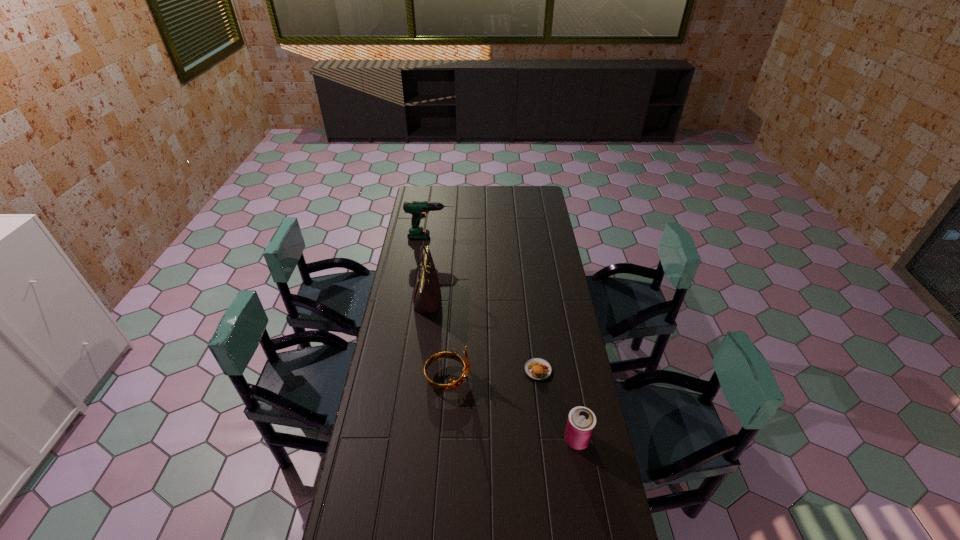
At what (x,y) coordinates should I click in order to perform the action: click on object that is the fourth closest one to the handbag. Please return your answer as a coordinate pair (x, y). Looking at the image, I should click on (581, 422).

This screenshot has width=960, height=540. In order to click on blank area in the image that satisfies the following two spatial constraints: 1. on the back side of the second shortest object; 2. on the handle side of the drill in this screenshot , I will do `click(541, 237)`.

Identify the location of vacant region that satisfies the following two spatial constraints: 1. on the handle side of the can; 2. on the left side of the drill. pos(402,440).

Identify the location of free space in the image that satisfies the following two spatial constraints: 1. on the handle side of the rightmost object; 2. on the right side of the drill. The image size is (960, 540). (402, 440).